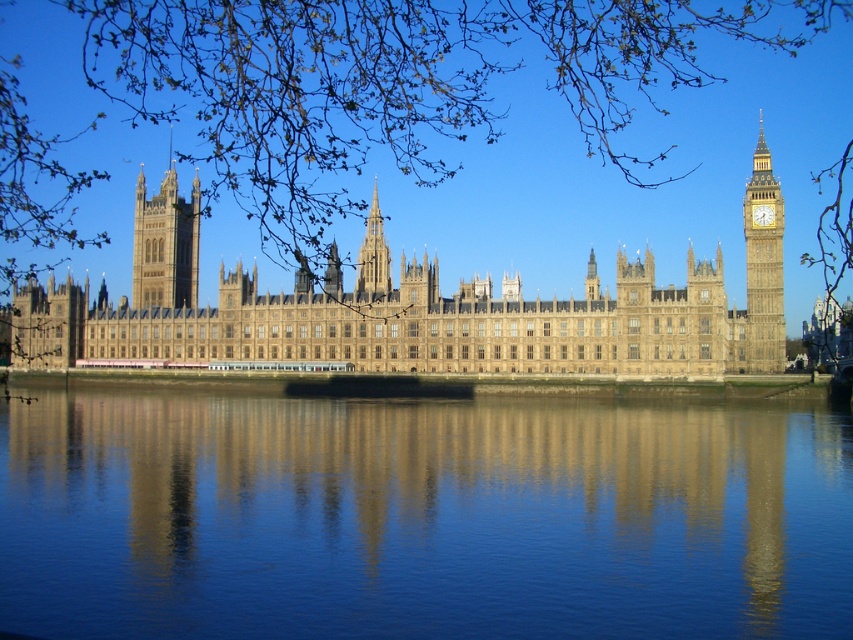
Question: Which point is closer to the camera taking this photo?

Choices:
 (A) (149, 224)
 (B) (779, 282)

Answer: (B)

Question: Is smooth blue water at center further to camera compared to golden stone tower at center?

Choices:
 (A) no
 (B) yes

Answer: (A)

Question: Is golden stone castle at center wider than golden stone tower at center?

Choices:
 (A) yes
 (B) no

Answer: (A)

Question: Which point is farther from the camera taking this photo?

Choices:
 (A) (154, 230)
 (B) (343, 330)
 (C) (747, 227)
 (D) (706, 428)

Answer: (A)

Question: Can you confirm if smooth blue water at center is positioned to the right of golden stone tower at center?

Choices:
 (A) no
 (B) yes

Answer: (B)

Question: Which object appears closest to the camera in this image?

Choices:
 (A) smooth blue water at center
 (B) golden stone clock tower at right

Answer: (A)